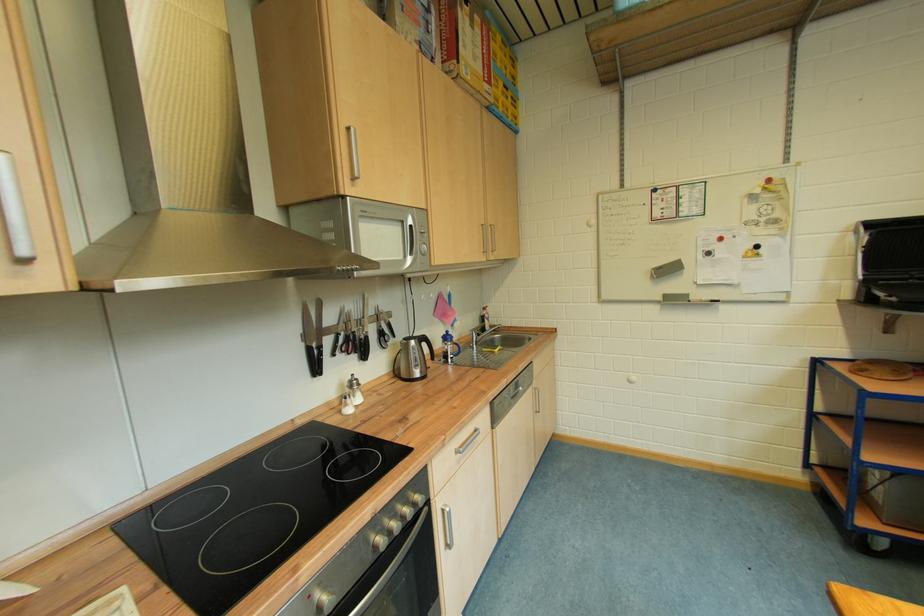
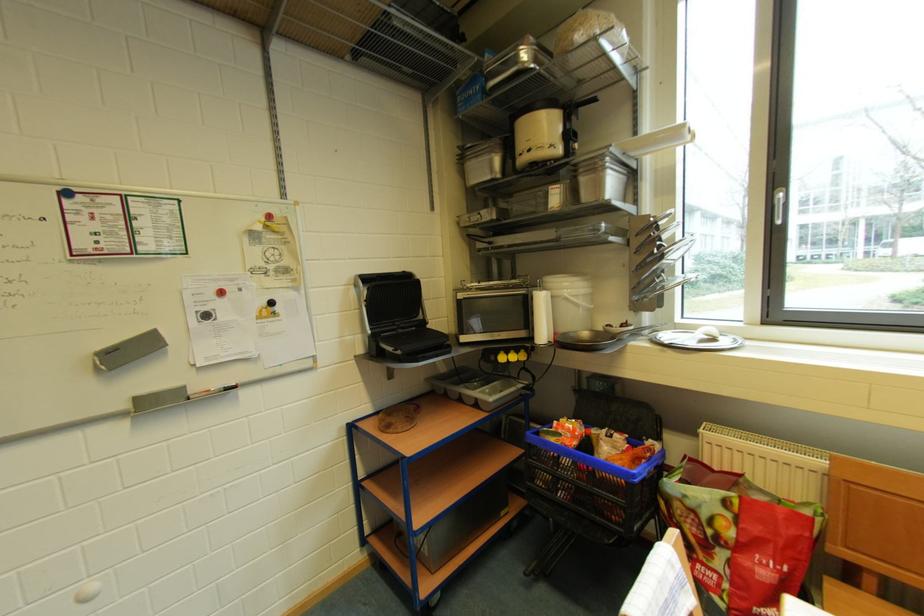
The point at (x=662, y=278) is marked in the first image. Where is the corresponding point in the second image?

(110, 370)